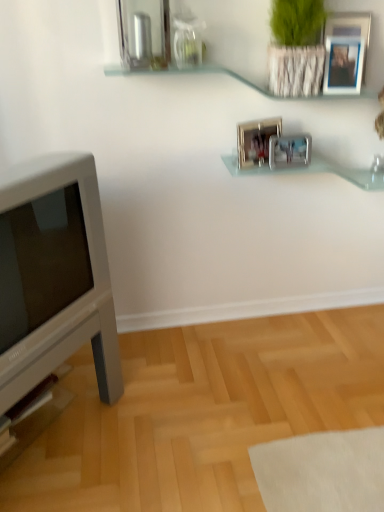
Question: Would you say clear glass shelf at upper center, the 1th shelf in the top-to-bottom sequence, is a long distance from metallic silver picture frame at upper center, the third picture frame ordered from the bottom?

Choices:
 (A) yes
 (B) no

Answer: (B)

Question: From a real-world perspective, is clear glass shelf at upper center, which is counted as the 2th shelf, starting from the bottom, located beneath metallic silver picture frame at upper center, acting as the first picture frame starting from the top?

Choices:
 (A) no
 (B) yes

Answer: (B)

Question: Is clear glass shelf at upper center, the 1th shelf in the top-to-bottom sequence, behind metallic silver picture frame at upper center, the third picture frame ordered from the bottom?

Choices:
 (A) no
 (B) yes

Answer: (A)

Question: Does clear glass shelf at upper center, which is counted as the 2th shelf, starting from the bottom, have a larger size compared to metallic silver picture frame at upper center, acting as the first picture frame starting from the top?

Choices:
 (A) yes
 (B) no

Answer: (A)

Question: Is clear glass shelf at upper center, the 1th shelf in the top-to-bottom sequence, oriented towards metallic silver picture frame at upper center, acting as the first picture frame starting from the top?

Choices:
 (A) yes
 (B) no

Answer: (B)

Question: In terms of height, does clear glass shelf at upper center, which is counted as the 2th shelf, starting from the bottom, look taller or shorter compared to clear glass shelf at center, which is counted as the first shelf, starting from the bottom?

Choices:
 (A) short
 (B) tall

Answer: (A)

Question: Would you say clear glass shelf at upper center, the 1th shelf in the top-to-bottom sequence, is to the left or to the right of clear glass shelf at center, which is counted as the first shelf, starting from the bottom, in the picture?

Choices:
 (A) left
 (B) right

Answer: (A)

Question: In the image, is clear glass shelf at upper center, which is counted as the 2th shelf, starting from the bottom, positioned in front of or behind clear glass shelf at center, which is counted as the first shelf, starting from the bottom?

Choices:
 (A) behind
 (B) front

Answer: (B)

Question: In terms of size, does clear glass shelf at upper center, the 1th shelf in the top-to-bottom sequence, appear bigger or smaller than clear glass shelf at center, the 2th shelf when ordered from top to bottom?

Choices:
 (A) small
 (B) big

Answer: (B)

Question: Does point (332, 37) appear closer or farther from the camera than point (221, 69)?

Choices:
 (A) closer
 (B) farther

Answer: (A)

Question: From their relative heights in the image, would you say metallic silver picture frame at upper center, marked as the 1th picture frame in a right-to-left arrangement, is taller or shorter than clear glass shelf at upper center, the 1th shelf in the top-to-bottom sequence?

Choices:
 (A) short
 (B) tall

Answer: (B)

Question: In terms of size, does metallic silver picture frame at upper center, the third picture frame ordered from the bottom, appear bigger or smaller than clear glass shelf at upper center, which is counted as the 2th shelf, starting from the bottom?

Choices:
 (A) small
 (B) big

Answer: (A)

Question: Considering their positions, is metallic silver picture frame at upper center, acting as the first picture frame starting from the top, located in front of or behind clear glass shelf at upper center, the 1th shelf in the top-to-bottom sequence?

Choices:
 (A) behind
 (B) front

Answer: (A)

Question: In terms of height, does clear glass shelf at upper center, the 1th shelf in the top-to-bottom sequence, look taller or shorter compared to metallic silver picture frame at upper center, marked as the 1th picture frame in a right-to-left arrangement?

Choices:
 (A) tall
 (B) short

Answer: (B)

Question: Would you say clear glass shelf at upper center, the 1th shelf in the top-to-bottom sequence, is inside or outside metallic silver picture frame at upper center, the third picture frame ordered from the bottom?

Choices:
 (A) inside
 (B) outside

Answer: (B)